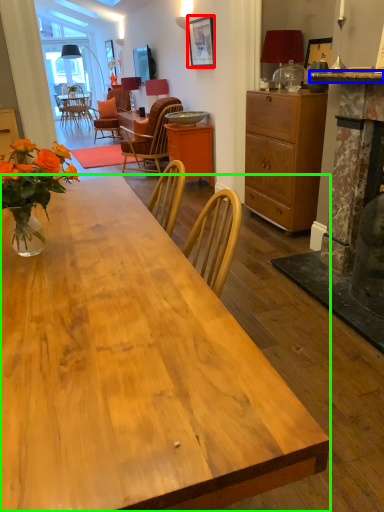
Question: Which is farther away from picture frame (highlighted by a red box)? counter top (highlighted by a blue box) or desk (highlighted by a green box)?

Choices:
 (A) counter top
 (B) desk

Answer: (B)